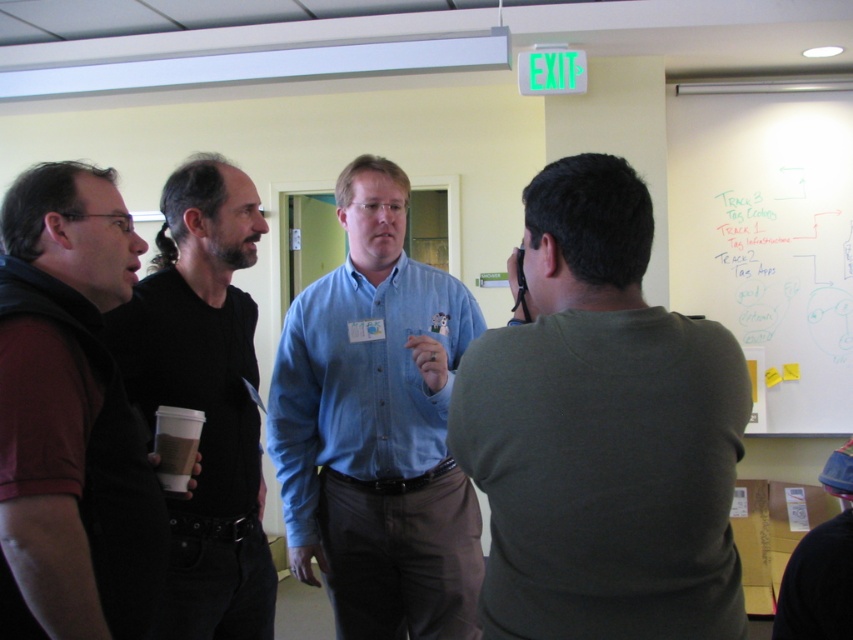
Which is more to the right, whiteboard at upper right or black matte shirt at left?

whiteboard at upper right is more to the right.

Identify the location of whiteboard at upper right. The image size is (853, 640). (769, 243).

Find the location of a particular element. whiteboard at upper right is located at coordinates (769, 243).

Does denim shirt at center have a larger size compared to maroon fabric shirt at left?

Correct, denim shirt at center is larger in size than maroon fabric shirt at left.

Does denim shirt at center appear over maroon fabric shirt at left?

No, denim shirt at center is not above maroon fabric shirt at left.

Identify the location of denim shirt at center. (376, 428).

Identify the location of denim shirt at center. (376, 428).

From the picture: Who is lower down, dark green t-shirt at center or whiteboard at upper right?

dark green t-shirt at center is lower down.

Can you confirm if dark green t-shirt at center is shorter than whiteboard at upper right?

Yes.

Where is `dark green t-shirt at center`? The height and width of the screenshot is (640, 853). dark green t-shirt at center is located at coordinates (602, 433).

You are a GUI agent. You are given a task and a screenshot of the screen. Output one action in this format:
    pyautogui.click(x=<x>, y=<y>)
    Task: Click on the dark green t-shirt at center
    The height and width of the screenshot is (640, 853).
    Given the screenshot: What is the action you would take?
    pyautogui.click(x=602, y=433)